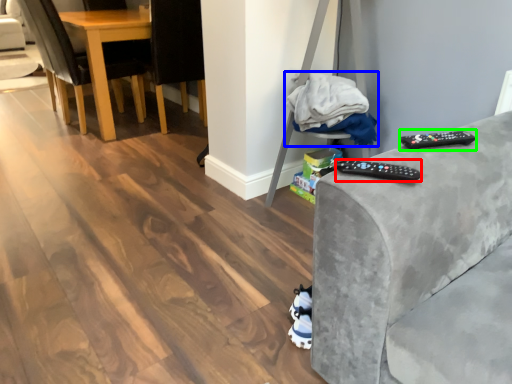
Question: Based on their relative distances, which object is farther from remote (highlighted by a red box)? Choose from material (highlighted by a blue box) and remote (highlighted by a green box).

Choices:
 (A) material
 (B) remote

Answer: (A)